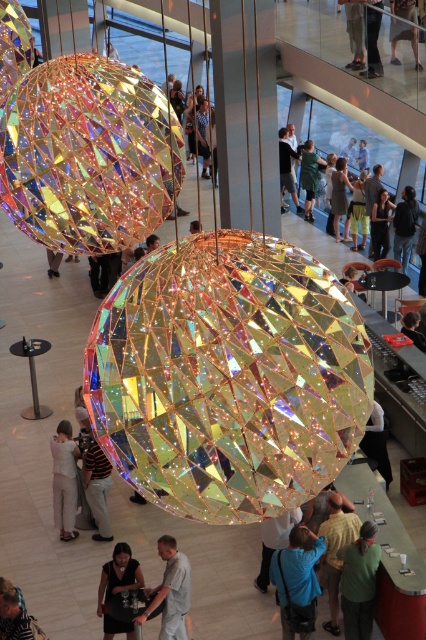
Can you confirm if matte black dress at center is positioned above striped shirt at center?

Actually, matte black dress at center is below striped shirt at center.

The width and height of the screenshot is (426, 640). What do you see at coordinates (118, 588) in the screenshot?
I see `matte black dress at center` at bounding box center [118, 588].

Locate an element on the screen. The width and height of the screenshot is (426, 640). matte black dress at center is located at coordinates (118, 588).

Does point (340, 580) lie behind point (290, 515)?

No, (340, 580) is in front of (290, 515).

Which is below, green matte sweater at lower center or blue fabric shirt at center?

Positioned lower is green matte sweater at lower center.

Measure the distance between green matte sweater at lower center and camera.

green matte sweater at lower center and camera are 14.31 meters apart from each other.

Find the location of a particular element. green matte sweater at lower center is located at coordinates (359, 582).

Does green fabric shirt at center appear on the right side of white fabric at center?

In fact, green fabric shirt at center is to the left of white fabric at center.

Between point (348, 532) and point (376, 412), which one is positioned in front?

Point (348, 532)

You are a GUI agent. You are given a task and a screenshot of the screen. Output one action in this format:
    pyautogui.click(x=<x>, y=<y>)
    Task: Click on the green fabric shirt at center
    Image resolution: width=426 pixels, height=640 pixels.
    Given the screenshot: What is the action you would take?
    pyautogui.click(x=336, y=550)